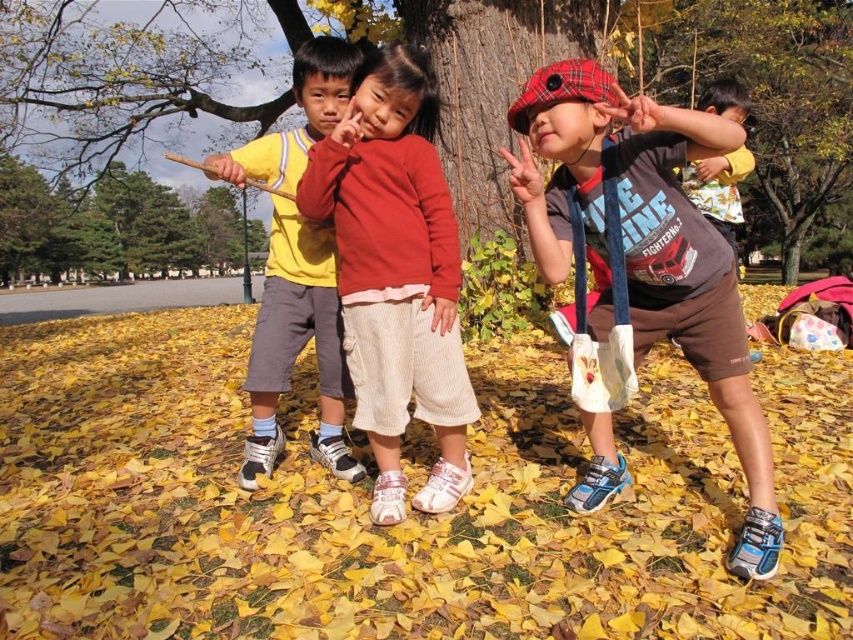
Where is `matte brown shorts at center`? This screenshot has width=853, height=640. matte brown shorts at center is located at coordinates (650, 248).

Can you confirm if matte brown shorts at center is taller than green leafy tree at left?

Indeed, matte brown shorts at center has a greater height compared to green leafy tree at left.

Is point (697, 365) closer to viewer compared to point (175, 211)?

Yes.

At what (x,y) coordinates should I click in order to perform the action: click on matte brown shorts at center. Please return your answer as a coordinate pair (x, y). The height and width of the screenshot is (640, 853). Looking at the image, I should click on (650, 248).

Does red corduroy pants at center have a greater height compared to yellow fabric shirt at center?

No.

Who is positioned more to the right, red corduroy pants at center or yellow fabric shirt at center?

Positioned to the right is red corduroy pants at center.

Who is more distant from viewer, (440, 316) or (326, 460)?

The point (326, 460) is more distant.

Where is `red corduroy pants at center`? The image size is (853, 640). red corduroy pants at center is located at coordinates (396, 273).

Does point (595, 49) lie behind point (434, 264)?

Yes, point (595, 49) is behind point (434, 264).

Who is more distant from viewer, (149, 72) or (397, 147)?

Point (149, 72)

Locate an element on the screen. brown textured tree at center is located at coordinates (641, 81).